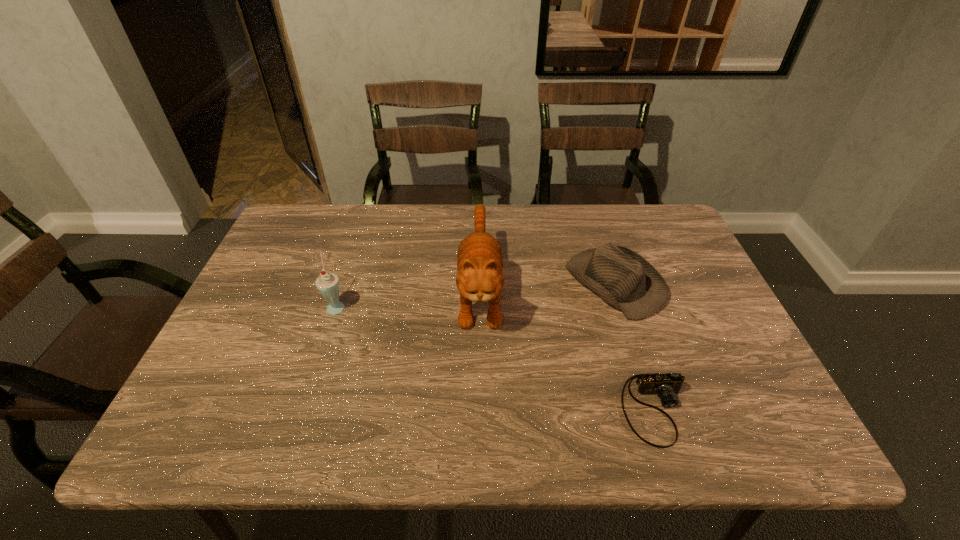
At what (x,y) coordinates should I click in order to perform the action: click on free location at the near right corner of the desktop. Please return your answer as a coordinate pair (x, y). This screenshot has width=960, height=540. Looking at the image, I should click on (780, 414).

Find the location of a particular element. This screenshot has height=540, width=960. empty space that is in between the milkshake and the nearest object is located at coordinates (496, 357).

Identify the location of vacant area between the nearest object and the milkshake. Image resolution: width=960 pixels, height=540 pixels. (496, 357).

Find the location of a particular element. vacant area that lies between the fedora and the tallest object is located at coordinates (547, 287).

Locate an element on the screen. free point between the second shortest object and the nearest object is located at coordinates (635, 346).

Identify the location of free space between the third shortest object and the cat. pyautogui.click(x=408, y=298).

Identify the location of unoccupied position between the third object from right to left and the third tallest object. The width and height of the screenshot is (960, 540). (547, 287).

Where is `free space between the nearest object and the tallest object`? This screenshot has width=960, height=540. free space between the nearest object and the tallest object is located at coordinates (567, 349).

The image size is (960, 540). In order to click on vacant point located between the second tallest object and the camera in this screenshot , I will do `click(496, 357)`.

Locate an element on the screen. This screenshot has height=540, width=960. vacant area that lies between the milkshake and the cat is located at coordinates click(408, 298).